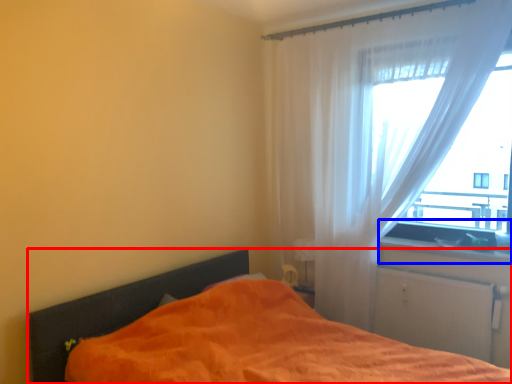
Question: Which object appears farthest to the camera in this image, bed (highlighted by a red box) or window sill (highlighted by a blue box)?

Choices:
 (A) bed
 (B) window sill

Answer: (B)